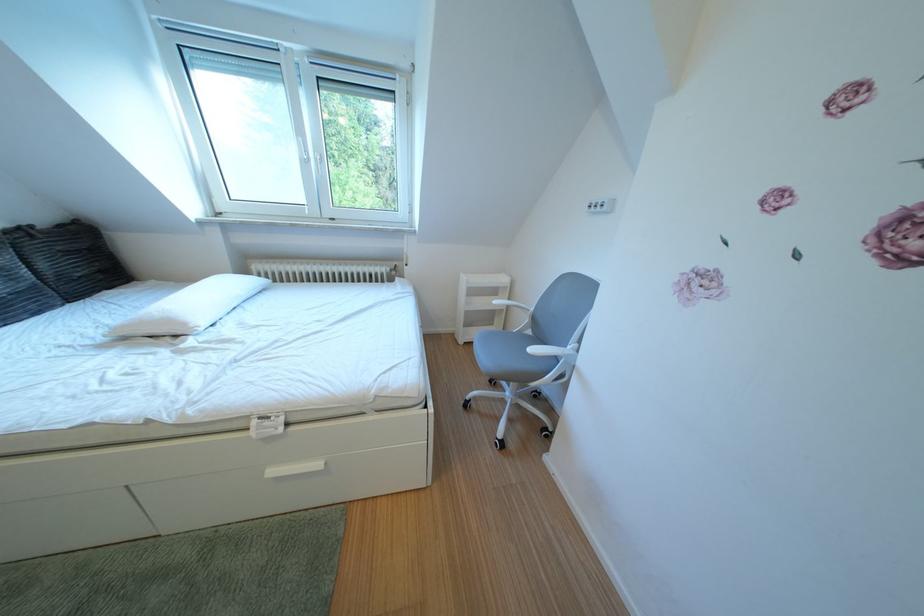
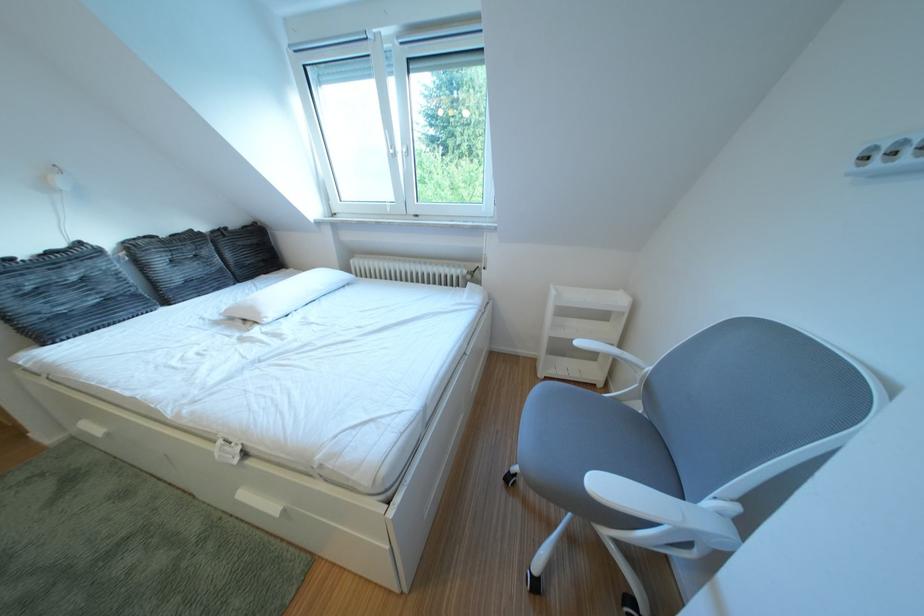
Question: The camera is either moving clockwise (left) or counter-clockwise (right) around the object. The first image is from the beginning of the video and the second image is from the end. Is the camera moving left or right when shooting the video?

Choices:
 (A) Left
 (B) Right

Answer: (B)